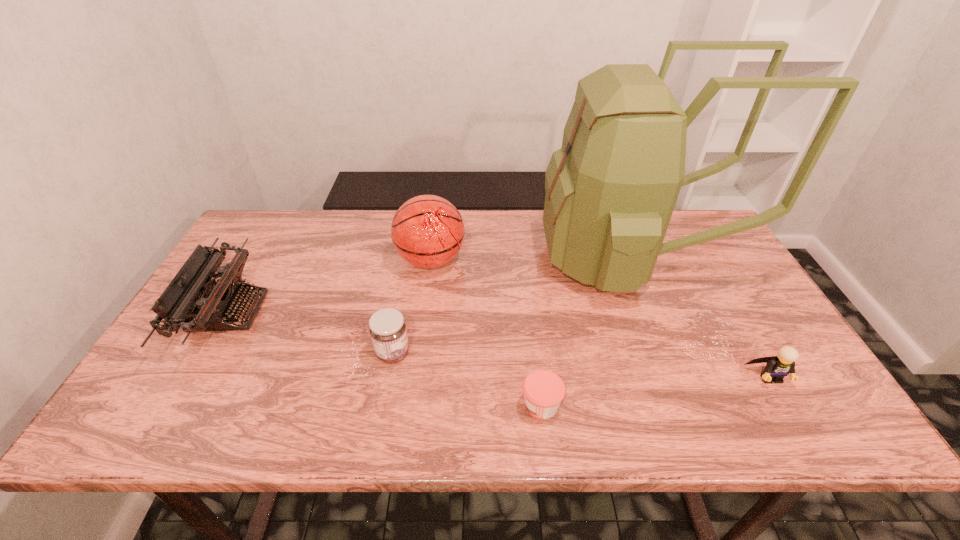
In the image, there is a desktop. Where is `vacant region at the near right corner`? This screenshot has width=960, height=540. vacant region at the near right corner is located at coordinates (830, 421).

The height and width of the screenshot is (540, 960). I want to click on empty space between the farther jam and the Lego, so click(x=581, y=365).

The width and height of the screenshot is (960, 540). What are the coordinates of `free space that is in between the Lego and the shortest object` in the screenshot? It's located at (656, 391).

Image resolution: width=960 pixels, height=540 pixels. What are the coordinates of `empty space between the typewriter and the tallest object` in the screenshot? It's located at (431, 285).

Locate an element on the screen. vacant area between the second tallest object and the Lego is located at coordinates (600, 319).

Where is `empty space that is in between the tallest object and the Lego`? Image resolution: width=960 pixels, height=540 pixels. empty space that is in between the tallest object and the Lego is located at coordinates (702, 318).

Find the location of a particular element. Image resolution: width=960 pixels, height=540 pixels. free spot between the leftmost object and the tallest object is located at coordinates (431, 285).

Image resolution: width=960 pixels, height=540 pixels. What are the coordinates of `free area in between the Lego and the fourth object from left to right` in the screenshot? It's located at (656, 391).

The height and width of the screenshot is (540, 960). I want to click on free point between the Lego and the typewriter, so click(x=499, y=345).

Locate an element on the screen. This screenshot has width=960, height=540. object identified as the third closest to the basketball is located at coordinates (192, 301).